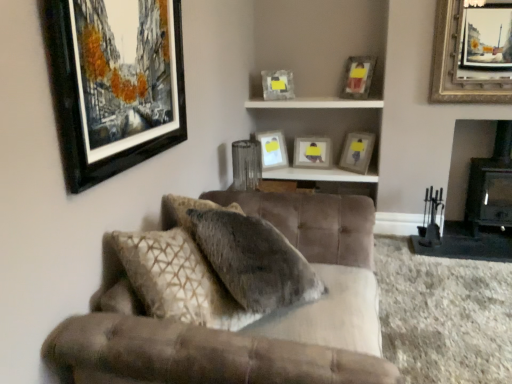
Question: From a real-world perspective, is wooden shelf at upper center physically above black matte picture frame at upper left, which is the seventh picture frame in right-to-left order?

Choices:
 (A) yes
 (B) no

Answer: (B)

Question: Can you confirm if wooden shelf at upper center is bigger than black matte picture frame at upper left, which is the seventh picture frame in right-to-left order?

Choices:
 (A) yes
 (B) no

Answer: (B)

Question: Is wooden shelf at upper center wider than black matte picture frame at upper left, arranged as the first picture frame when viewed from the front?

Choices:
 (A) no
 (B) yes

Answer: (B)

Question: Are wooden shelf at upper center and black matte picture frame at upper left, placed as the 1th picture frame when sorted from left to right, far apart?

Choices:
 (A) no
 (B) yes

Answer: (B)

Question: Is wooden shelf at upper center to the right of black matte picture frame at upper left, arranged as the first picture frame when viewed from the front, from the viewer's perspective?

Choices:
 (A) yes
 (B) no

Answer: (A)

Question: Is wooden shelf at upper center oriented away from black matte picture frame at upper left, placed as the 1th picture frame when sorted from left to right?

Choices:
 (A) no
 (B) yes

Answer: (A)

Question: Does black matte picture frame at upper left, placed as the 1th picture frame when sorted from left to right, turn towards matte gray picture frame at center, acting as the seventh picture frame starting from the front?

Choices:
 (A) no
 (B) yes

Answer: (A)

Question: From a real-world perspective, is black matte picture frame at upper left, placed as the 1th picture frame when sorted from left to right, under matte gray picture frame at center, acting as the seventh picture frame starting from the front?

Choices:
 (A) yes
 (B) no

Answer: (B)

Question: Is black matte picture frame at upper left, placed as the 1th picture frame when sorted from left to right, directly adjacent to matte gray picture frame at center, which appears as the 1th picture frame when viewed from the back?

Choices:
 (A) no
 (B) yes

Answer: (A)

Question: Is black matte picture frame at upper left, arranged as the first picture frame when viewed from the front, shorter than matte gray picture frame at center, acting as the seventh picture frame starting from the front?

Choices:
 (A) no
 (B) yes

Answer: (A)

Question: Considering the relative sizes of black matte picture frame at upper left, placed as the 1th picture frame when sorted from left to right, and matte gray picture frame at center, which appears as the 1th picture frame when viewed from the back, in the image provided, is black matte picture frame at upper left, placed as the 1th picture frame when sorted from left to right, thinner than matte gray picture frame at center, which appears as the 1th picture frame when viewed from the back,?

Choices:
 (A) no
 (B) yes

Answer: (B)

Question: Can you confirm if black matte picture frame at upper left, which is the seventh picture frame in right-to-left order, is positioned to the right of matte gray picture frame at center, the 4th picture frame from the left?

Choices:
 (A) no
 (B) yes

Answer: (A)

Question: Is matte glass picture frame at upper center, which is the 5th picture frame in right-to-left order, positioned in front of black matte picture frame at upper left, placed as the 1th picture frame when sorted from left to right?

Choices:
 (A) yes
 (B) no

Answer: (B)